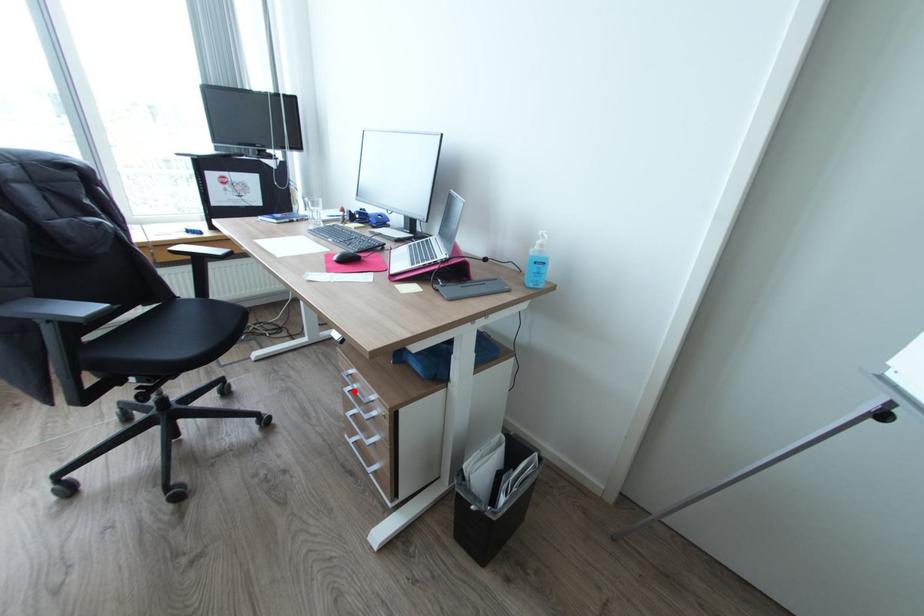
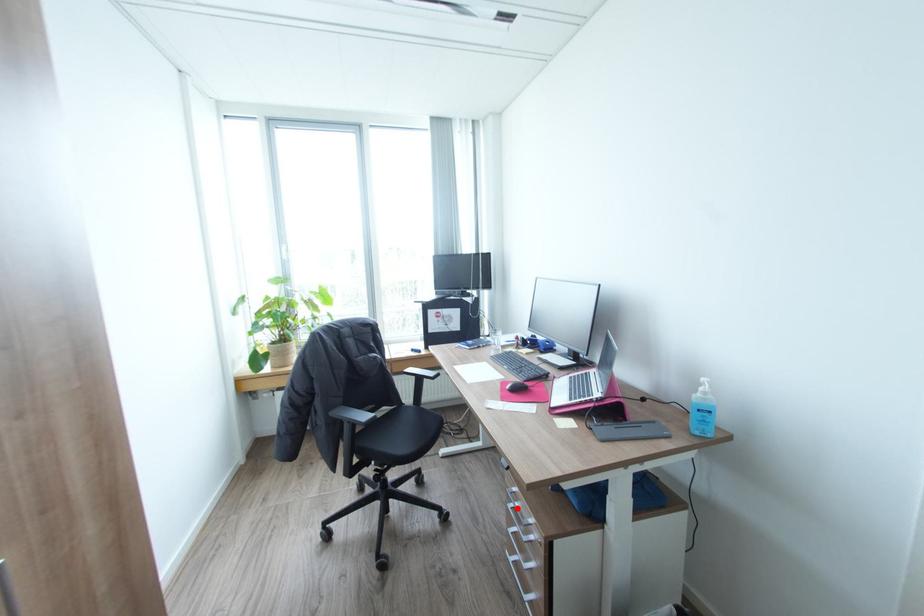
I am providing you with two images of the same scene from different viewpoints. A red point is marked on the first image and another point is marked on the second image. Are the points marked in image1 and image2 representing the same 3D position?

Yes